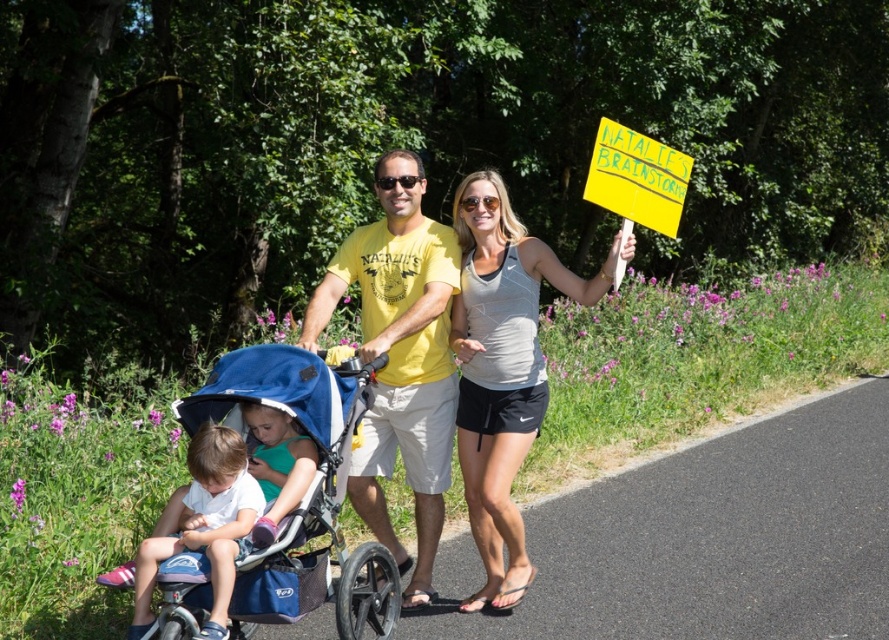
You are a photographer standing at the edge of the road. You want to take a photo of the gray athletic tank top at upper center and the matte green shirt at center. The camera you have can focus on objects within a 1.2 meters range. Will both subjects be in focus?

The gray athletic tank top at upper center is 1.31 meters away from matte green shirt at center. Since the distance between them exceeds the camera focus range of 1.2 meters, the camera cannot focus on both subjects simultaneously.

You are a photographer taking a picture of the family scene. You need to focus on two specific points in the image, point 1 at (433, 307) and point 2 at (189, 468). Which point is closer to the camera?

Point 1 at (433, 307) is closer to the camera than point 2 at (189, 468).